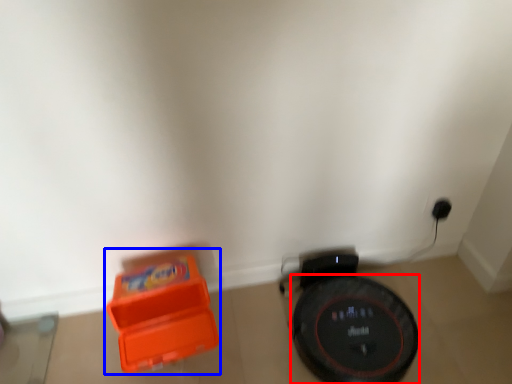
Question: Which object is further to the camera taking this photo, wheel (highlighted by a red box) or toy (highlighted by a blue box)?

Choices:
 (A) wheel
 (B) toy

Answer: (A)